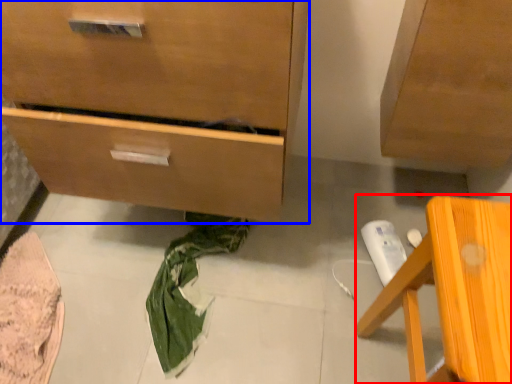
Question: Which object is closer to the camera taking this photo, furniture (highlighted by a red box) or chest of drawers (highlighted by a blue box)?

Choices:
 (A) furniture
 (B) chest of drawers

Answer: (A)